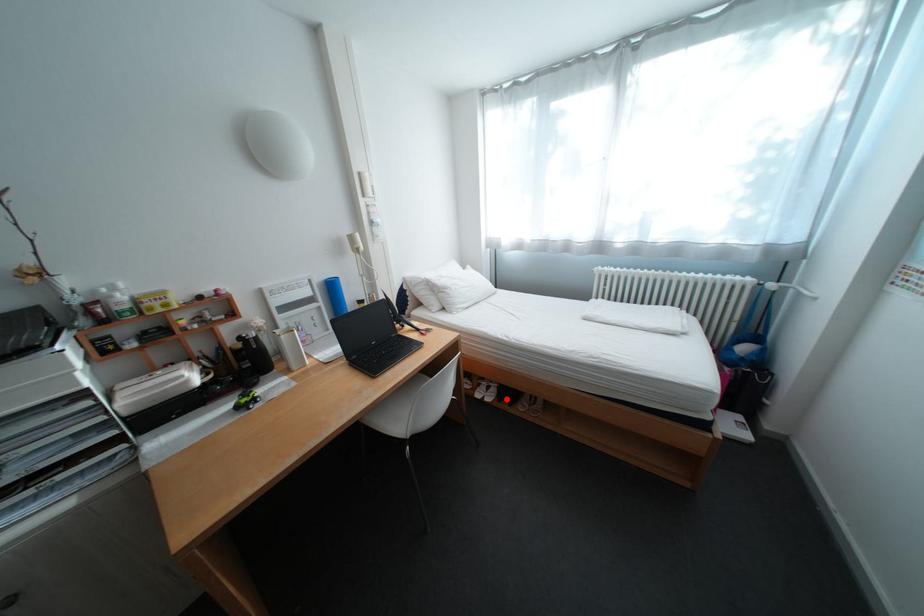
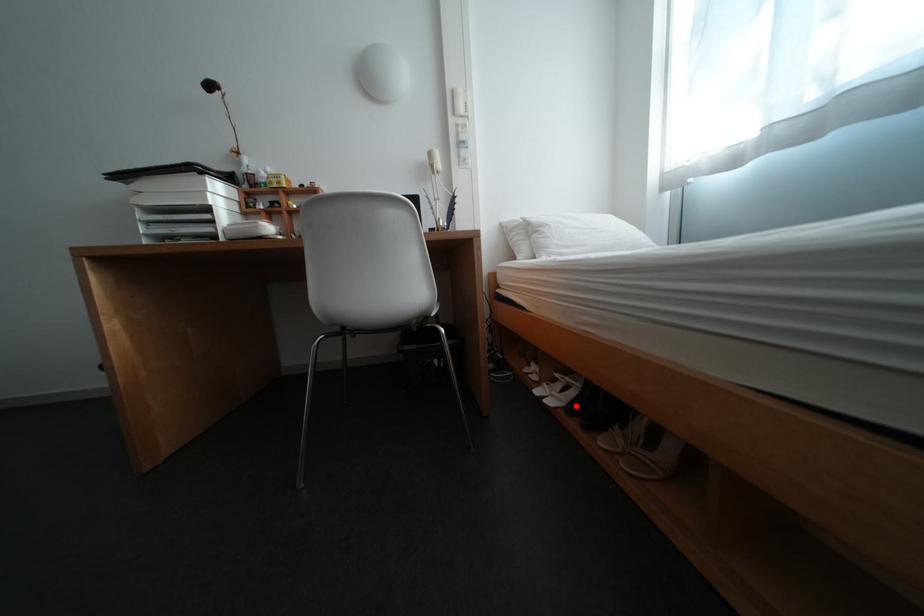
I am providing you with two images of the same scene from different viewpoints. A red point is marked on the first image and another point is marked on the second image. Are the points marked in image1 and image2 representing the same 3D position?

Yes